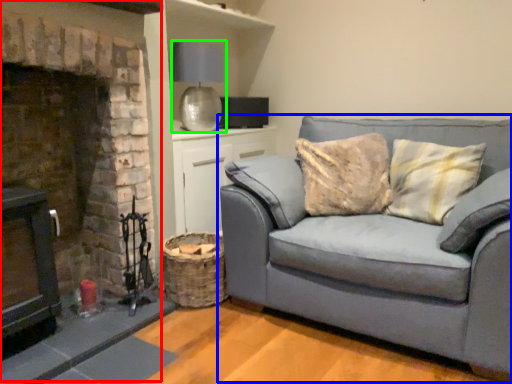
Question: Considering the real-world distances, which object is farthest from fireplace (highlighted by a red box)? studio couch (highlighted by a blue box) or lamp (highlighted by a green box)?

Choices:
 (A) studio couch
 (B) lamp

Answer: (A)